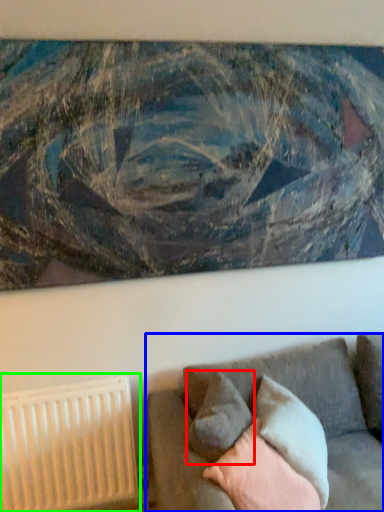
Question: Which is farther away from pillow (highlighted by a red box)? studio couch (highlighted by a blue box) or radiator (highlighted by a green box)?

Choices:
 (A) studio couch
 (B) radiator

Answer: (B)